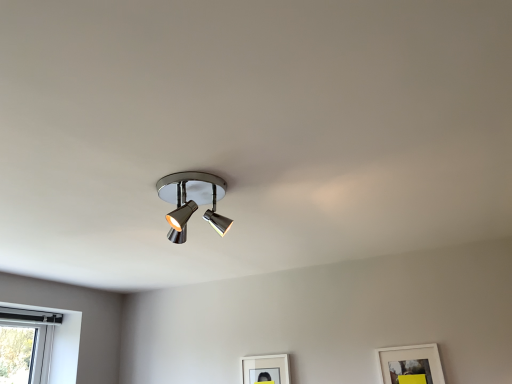
How much space does white matte picture frame at lower right, which is the second picture frame from left to right, occupy horizontally?

white matte picture frame at lower right, which is the second picture frame from left to right, is 2.00 inches in width.

This screenshot has width=512, height=384. What do you see at coordinates (409, 364) in the screenshot?
I see `white matte picture frame at lower right, which is the 1th picture frame in right-to-left order` at bounding box center [409, 364].

Where is `polished chrome spotlight at center`? This screenshot has width=512, height=384. polished chrome spotlight at center is located at coordinates (192, 201).

Consider the image. Who is bigger, polished chrome spotlight at center or white matte picture frame at lower right, which is the 1th picture frame in right-to-left order?

With larger size is polished chrome spotlight at center.

From a real-world perspective, does polished chrome spotlight at center stand above white matte picture frame at lower right, which is the 1th picture frame in right-to-left order?

Indeed, from a real-world perspective, polished chrome spotlight at center stands above white matte picture frame at lower right, which is the 1th picture frame in right-to-left order.

Which of these two, polished chrome spotlight at center or white matte picture frame at lower right, marked as the 2th picture frame in a back-to-front arrangement, is wider?

With larger width is polished chrome spotlight at center.

In the image, is polished chrome spotlight at center on the left side or the right side of white matte picture frame at lower right, which is the second picture frame from left to right?

Clearly, polished chrome spotlight at center is on the left of white matte picture frame at lower right, which is the second picture frame from left to right, in the image.

Is matte white picture frame at lower center, the 1th picture frame in the back-to-front sequence, to the right of white matte picture frame at lower right, marked as the 2th picture frame in a back-to-front arrangement, from the viewer's perspective?

No.

How much distance is there between matte white picture frame at lower center, the 1th picture frame in the back-to-front sequence, and white matte picture frame at lower right, the first picture frame positioned from the front?

25.02 inches.

Is matte white picture frame at lower center, which is the first picture frame from left to right, looking in the opposite direction of white matte picture frame at lower right, the first picture frame positioned from the front?

matte white picture frame at lower center, which is the first picture frame from left to right, does not have its back to white matte picture frame at lower right, the first picture frame positioned from the front.

In terms of size, does matte white picture frame at lower center, which is the first picture frame from left to right, appear bigger or smaller than white matte picture frame at lower right, marked as the 2th picture frame in a back-to-front arrangement?

Considering their sizes, matte white picture frame at lower center, which is the first picture frame from left to right, takes up less space than white matte picture frame at lower right, marked as the 2th picture frame in a back-to-front arrangement.

Which is more to the right, matte white picture frame at lower center, marked as the second picture frame in a right-to-left arrangement, or polished chrome spotlight at center?

matte white picture frame at lower center, marked as the second picture frame in a right-to-left arrangement, is more to the right.

Is matte white picture frame at lower center, the second picture frame in the front-to-back sequence, not near polished chrome spotlight at center?

Indeed, matte white picture frame at lower center, the second picture frame in the front-to-back sequence, is not near polished chrome spotlight at center.

Does matte white picture frame at lower center, the second picture frame in the front-to-back sequence, come behind polished chrome spotlight at center?

Yes, it is.

Does matte white picture frame at lower center, marked as the second picture frame in a right-to-left arrangement, have a greater width compared to polished chrome spotlight at center?

In fact, matte white picture frame at lower center, marked as the second picture frame in a right-to-left arrangement, might be narrower than polished chrome spotlight at center.

Is white matte picture frame at lower right, which is the second picture frame from left to right, not close to matte white picture frame at lower center, the 1th picture frame in the back-to-front sequence?

white matte picture frame at lower right, which is the second picture frame from left to right, is actually quite close to matte white picture frame at lower center, the 1th picture frame in the back-to-front sequence.

Considering the relative sizes of white matte picture frame at lower right, the first picture frame positioned from the front, and matte white picture frame at lower center, the second picture frame in the front-to-back sequence, in the image provided, is white matte picture frame at lower right, the first picture frame positioned from the front, thinner than matte white picture frame at lower center, the second picture frame in the front-to-back sequence,?

No.

Which object is further away from the camera, white matte picture frame at lower right, the first picture frame positioned from the front, or matte white picture frame at lower center, the 1th picture frame in the back-to-front sequence?

matte white picture frame at lower center, the 1th picture frame in the back-to-front sequence, is further from the camera.

From the picture: Is matte white picture frame at lower center, the second picture frame in the front-to-back sequence, completely or partially inside white matte picture frame at lower right, which is the second picture frame from left to right?

No, white matte picture frame at lower right, which is the second picture frame from left to right, does not contain matte white picture frame at lower center, the second picture frame in the front-to-back sequence.

Does white matte picture frame at lower right, which is the 1th picture frame in right-to-left order, turn towards polished chrome spotlight at center?

Yes, white matte picture frame at lower right, which is the 1th picture frame in right-to-left order, is turned towards polished chrome spotlight at center.

Is polished chrome spotlight at center inside white matte picture frame at lower right, marked as the 2th picture frame in a back-to-front arrangement?

Actually, polished chrome spotlight at center is outside white matte picture frame at lower right, marked as the 2th picture frame in a back-to-front arrangement.

What's the angular difference between white matte picture frame at lower right, which is the second picture frame from left to right, and polished chrome spotlight at center's facing directions?

0.631 degrees.

Between white matte picture frame at lower right, which is the second picture frame from left to right, and polished chrome spotlight at center, which one has smaller size?

Smaller between the two is white matte picture frame at lower right, which is the second picture frame from left to right.

Consider the image. Between polished chrome spotlight at center and matte white picture frame at lower center, marked as the second picture frame in a right-to-left arrangement, which one has smaller size?

matte white picture frame at lower center, marked as the second picture frame in a right-to-left arrangement, is smaller.

Are polished chrome spotlight at center and matte white picture frame at lower center, the second picture frame in the front-to-back sequence, located far from each other?

Indeed, polished chrome spotlight at center is not near matte white picture frame at lower center, the second picture frame in the front-to-back sequence.

There is a matte white picture frame at lower center, the second picture frame in the front-to-back sequence. Identify the location of lamp above it (from a real-world perspective). This screenshot has height=384, width=512. (192, 201).

Is polished chrome spotlight at center positioned in front of matte white picture frame at lower center, the second picture frame in the front-to-back sequence?

That is True.

You are a GUI agent. You are given a task and a screenshot of the screen. Output one action in this format:
    pyautogui.click(x=<x>, y=<y>)
    Task: Click on the picture frame that is the 2nd one below the polished chrome spotlight at center (from a real-world perspective)
    Image resolution: width=512 pixels, height=384 pixels.
    Given the screenshot: What is the action you would take?
    pyautogui.click(x=409, y=364)

You are a GUI agent. You are given a task and a screenshot of the screen. Output one action in this format:
    pyautogui.click(x=<x>, y=<y>)
    Task: Click on the picture frame lying in front of the matte white picture frame at lower center, the 1th picture frame in the back-to-front sequence
    The image size is (512, 384).
    Given the screenshot: What is the action you would take?
    pyautogui.click(x=409, y=364)

From the image, which object appears to be nearer to matte white picture frame at lower center, which is the first picture frame from left to right, polished chrome spotlight at center or white matte picture frame at lower right, which is the second picture frame from left to right?

The object closer to matte white picture frame at lower center, which is the first picture frame from left to right, is white matte picture frame at lower right, which is the second picture frame from left to right.

From the image, which object appears to be nearer to white matte picture frame at lower right, which is the second picture frame from left to right, matte white picture frame at lower center, the 1th picture frame in the back-to-front sequence, or polished chrome spotlight at center?

Based on the image, matte white picture frame at lower center, the 1th picture frame in the back-to-front sequence, appears to be nearer to white matte picture frame at lower right, which is the second picture frame from left to right.

Looking at the image, which one is located closer to polished chrome spotlight at center, white matte picture frame at lower right, the first picture frame positioned from the front, or matte white picture frame at lower center, the second picture frame in the front-to-back sequence?

Among the two, matte white picture frame at lower center, the second picture frame in the front-to-back sequence, is located nearer to polished chrome spotlight at center.

Estimate the real-world distances between objects in this image. Which object is closer to polished chrome spotlight at center, matte white picture frame at lower center, which is the first picture frame from left to right, or white matte picture frame at lower right, which is the second picture frame from left to right?

matte white picture frame at lower center, which is the first picture frame from left to right, is closer to polished chrome spotlight at center.

Which object lies further to the anchor point matte white picture frame at lower center, which is the first picture frame from left to right, white matte picture frame at lower right, the first picture frame positioned from the front, or polished chrome spotlight at center?

polished chrome spotlight at center is positioned further to the anchor matte white picture frame at lower center, which is the first picture frame from left to right.

Estimate the real-world distances between objects in this image. Which object is closer to white matte picture frame at lower right, which is the 1th picture frame in right-to-left order, polished chrome spotlight at center or matte white picture frame at lower center, marked as the second picture frame in a right-to-left arrangement?

Based on the image, matte white picture frame at lower center, marked as the second picture frame in a right-to-left arrangement, appears to be nearer to white matte picture frame at lower right, which is the 1th picture frame in right-to-left order.

Identify the location of picture frame between polished chrome spotlight at center and matte white picture frame at lower center, marked as the second picture frame in a right-to-left arrangement, along the z-axis. (409, 364).